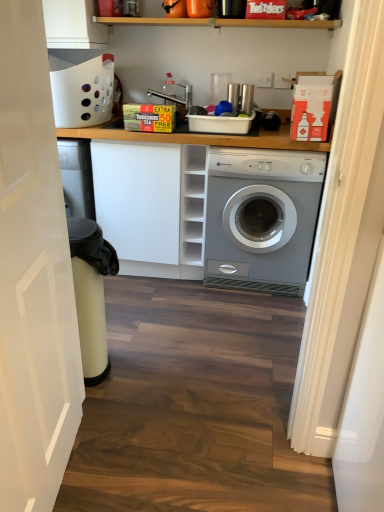
What do you see at coordinates (138, 198) in the screenshot? This screenshot has width=384, height=512. I see `white matte cabinet at center` at bounding box center [138, 198].

Describe the element at coordinates (33, 276) in the screenshot. This screenshot has height=512, width=384. I see `white matte door at left` at that location.

Measure the distance between point (312, 228) and camera.

They are 7.44 feet apart.

What is the approximate width of silver metallic washing machine at center-right?

silver metallic washing machine at center-right is 25.26 inches wide.

Locate an element on the screen. This screenshot has width=384, height=512. white matte cabinet at center is located at coordinates (138, 198).

Considering the relative sizes of white matte cabinet at center and silver metallic washing machine at center-right in the image provided, is white matte cabinet at center wider than silver metallic washing machine at center-right?

In fact, white matte cabinet at center might be narrower than silver metallic washing machine at center-right.

Is white matte cabinet at center taller than silver metallic washing machine at center-right?

Yes, white matte cabinet at center is taller than silver metallic washing machine at center-right.

Is white matte cabinet at center far away from silver metallic washing machine at center-right?

No, there isn't a large distance between white matte cabinet at center and silver metallic washing machine at center-right.

Is point (132, 176) farther from viewer compared to point (225, 269)?

No, it is not.

Is white matte cabinet at center positioned with its back to white matte door at left?

That's not correct — white matte cabinet at center is not looking away from white matte door at left.

Does point (152, 146) appear closer or farther from the camera than point (45, 259)?

Point (152, 146) is farther from the camera than point (45, 259).

The height and width of the screenshot is (512, 384). In order to click on cabinetry located above the white matte door at left (from the image's perspective) in this screenshot , I will do `click(138, 198)`.

Between white matte cabinet at center and white matte door at left, which one has smaller width?

Thinner between the two is white matte door at left.

In the scene shown: How much distance is there between white matte door at left and white matte cabinet at center?

A distance of 3.55 feet exists between white matte door at left and white matte cabinet at center.

Where is `door that is above the white matte cabinet at center (from a real-world perspective)`? This screenshot has height=512, width=384. door that is above the white matte cabinet at center (from a real-world perspective) is located at coordinates (33, 276).

From the image's perspective, who appears lower, white matte door at left or white matte cabinet at center?

From the image's view, white matte door at left is below.

Looking at the image, does white matte door at left seem bigger or smaller compared to white matte cabinet at center?

white matte door at left is smaller than white matte cabinet at center.

Is silver metallic washing machine at center-right with white matte cabinet at center?

No, silver metallic washing machine at center-right is not beside white matte cabinet at center.

Which is nearer, (x=289, y=159) or (x=161, y=191)?

Positioned in front is point (x=289, y=159).

The width and height of the screenshot is (384, 512). Identify the location of washing machine above the white matte cabinet at center (from a real-world perspective). (261, 218).

Consider the image. From the image's perspective, is silver metallic washing machine at center-right located above white matte cabinet at center?

No, from the image's perspective, silver metallic washing machine at center-right is not over white matte cabinet at center.

Does silver metallic washing machine at center-right appear on the left side of white matte door at left?

Incorrect, silver metallic washing machine at center-right is not on the left side of white matte door at left.

In the image, is silver metallic washing machine at center-right positioned in front of or behind white matte door at left?

Clearly, silver metallic washing machine at center-right is behind white matte door at left.

This screenshot has width=384, height=512. In order to click on door below the silver metallic washing machine at center-right (from the image's perspective) in this screenshot , I will do `click(33, 276)`.

Is silver metallic washing machine at center-right completely or partially outside of white matte door at left?

Absolutely, silver metallic washing machine at center-right is external to white matte door at left.

Does white matte door at left lie in front of silver metallic washing machine at center-right?

Yes, it is in front of silver metallic washing machine at center-right.

Considering the sizes of objects white matte door at left and silver metallic washing machine at center-right in the image provided, who is bigger, white matte door at left or silver metallic washing machine at center-right?

silver metallic washing machine at center-right.

From the image's perspective, which one is positioned lower, white matte door at left or silver metallic washing machine at center-right?

white matte door at left.

Could you tell me if white matte door at left is turned towards silver metallic washing machine at center-right?

→ No, white matte door at left is not turned towards silver metallic washing machine at center-right.

Find the location of a particular element. The image size is (384, 512). washing machine above the white matte cabinet at center (from a real-world perspective) is located at coordinates (261, 218).

At what (x,y) coordinates should I click in order to perform the action: click on cabinetry behind the white matte door at left. Please return your answer as a coordinate pair (x, y). The width and height of the screenshot is (384, 512). Looking at the image, I should click on (138, 198).

Considering their positions, is silver metallic washing machine at center-right positioned closer to white matte cabinet at center than white matte door at left?

silver metallic washing machine at center-right lies closer to white matte cabinet at center than the other object.

From the picture: When comparing their distances from white matte door at left, does white matte cabinet at center or silver metallic washing machine at center-right seem further?

silver metallic washing machine at center-right is further to white matte door at left.

Considering their positions, is white matte cabinet at center positioned further to silver metallic washing machine at center-right than white matte door at left?

white matte door at left.

Based on the photo, looking at the image, which one is located further to white matte door at left, silver metallic washing machine at center-right or white matte cabinet at center?

The object further to white matte door at left is silver metallic washing machine at center-right.

Looking at the image, which one is located further to silver metallic washing machine at center-right, white matte door at left or white matte cabinet at center?

Based on the image, white matte door at left appears to be further to silver metallic washing machine at center-right.

Considering their positions, is white matte door at left positioned further to white matte cabinet at center than silver metallic washing machine at center-right?

The object further to white matte cabinet at center is white matte door at left.

Locate an element on the screen. The width and height of the screenshot is (384, 512). washing machine positioned between white matte door at left and white matte cabinet at center from near to far is located at coordinates (261, 218).